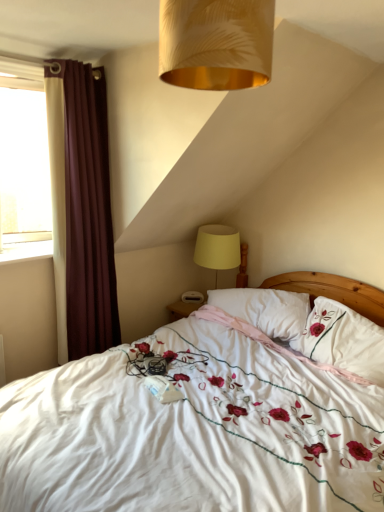
Question: Considering the positions of white glossy window sill at left and white embroidered pillow at upper right, marked as the second pillow in a left-to-right arrangement, in the image, is white glossy window sill at left taller or shorter than white embroidered pillow at upper right, marked as the second pillow in a left-to-right arrangement,?

Choices:
 (A) short
 (B) tall

Answer: (A)

Question: From a real-world perspective, is white glossy window sill at left positioned above or below white embroidered pillow at upper right, marked as the 1th pillow in a right-to-left arrangement?

Choices:
 (A) above
 (B) below

Answer: (A)

Question: Which of these objects is positioned closest to the yellow fabric lampshade at upper right?

Choices:
 (A) white embroidered pillow at upper right, marked as the 1th pillow in a right-to-left arrangement
 (B) maroon fabric curtain at left
 (C) gold textured lampshade at upper center
 (D) white embroidered fabric at center
 (E) white glossy window sill at left

Answer: (B)

Question: Which is nearer to the white embroidered pillow at upper right, marked as the 1th pillow in a right-to-left arrangement?

Choices:
 (A) white soft pillow at center, acting as the 2th pillow starting from the right
 (B) yellow fabric lampshade at upper right
 (C) white embroidered fabric at center
 (D) maroon fabric curtain at left
 (E) gold textured lampshade at upper center

Answer: (A)